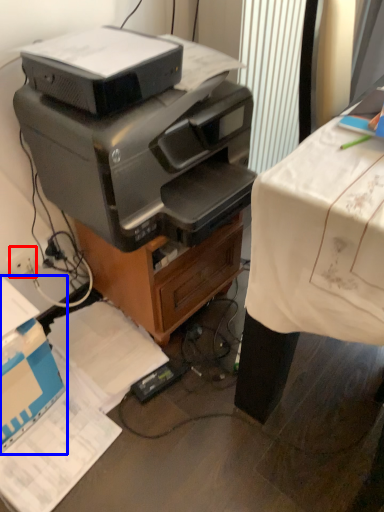
Question: Which object appears closest to the camera in this image, plug (highlighted by a red box) or cardboard box (highlighted by a blue box)?

Choices:
 (A) plug
 (B) cardboard box

Answer: (B)